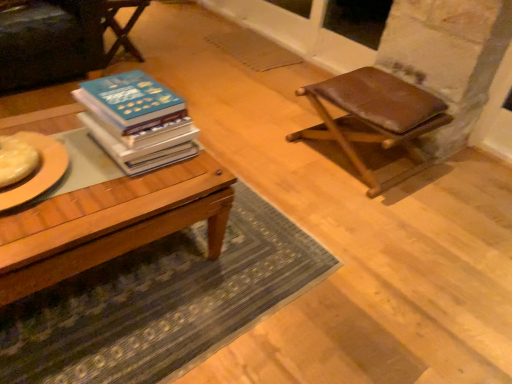
This screenshot has height=384, width=512. What are the coordinates of `space that is in front of brown leather stool at right` in the screenshot? It's located at (368, 218).